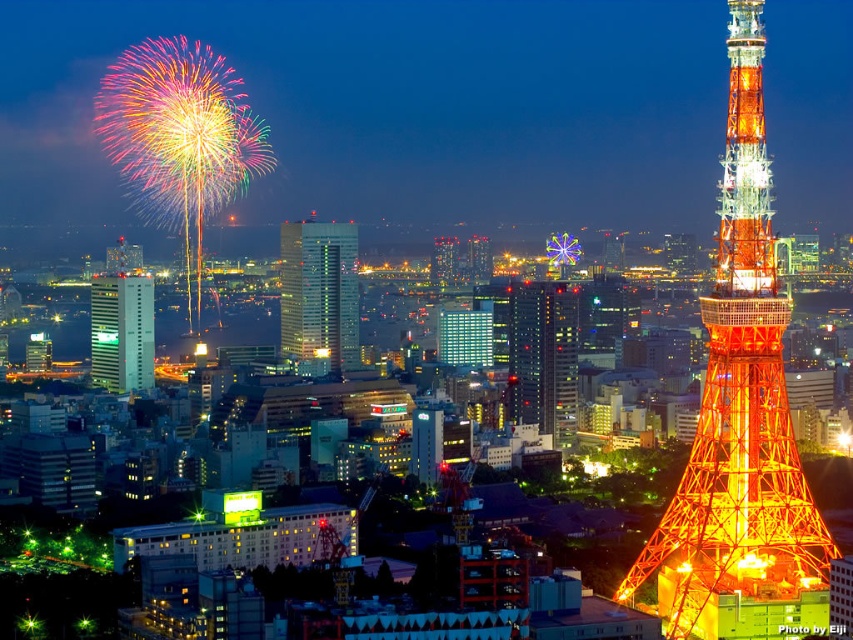
Question: In this image, where is shiny glass skyscraper at center located relative to green glass building at center?

Choices:
 (A) below
 (B) above

Answer: (A)

Question: Based on their relative distances, which object is nearer to the shiny orange tower at right?

Choices:
 (A) green glass building at center
 (B) shiny glass skyscraper at center
 (C) green glass skyscraper at center

Answer: (B)

Question: Which object is the closest to the shiny orange tower at right?

Choices:
 (A) green glass building at center
 (B) shiny glass skyscraper at center

Answer: (B)

Question: Does shiny orange tower at right lie in front of shiny glass skyscraper at center?

Choices:
 (A) yes
 (B) no

Answer: (B)

Question: Does green glass skyscraper at center appear on the right side of shiny glass skyscraper at center?

Choices:
 (A) no
 (B) yes

Answer: (A)

Question: Estimate the real-world distances between objects in this image. Which object is farther from the shiny glass skyscraper at center?

Choices:
 (A) shiny orange tower at right
 (B) green glass building at center

Answer: (B)